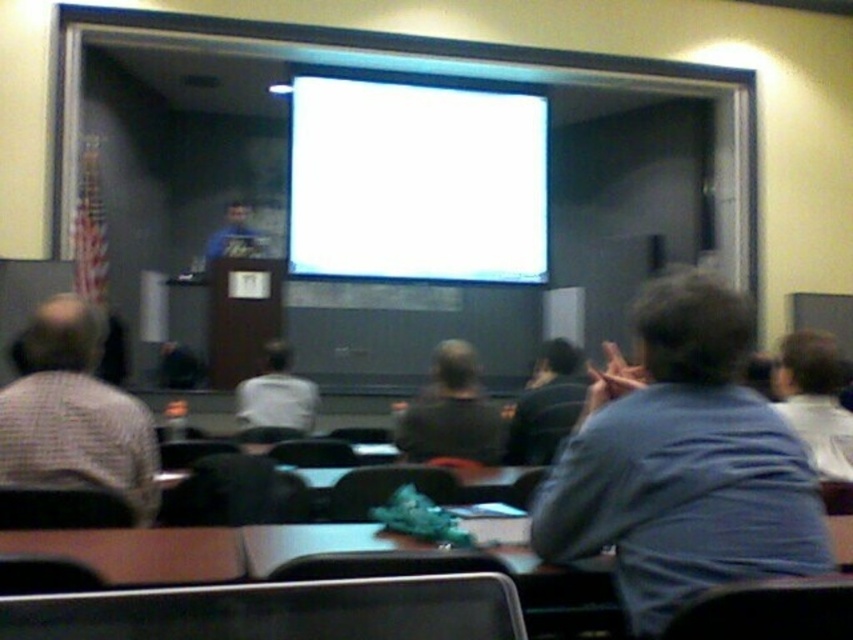
Question: Which object is farther from the camera taking this photo?

Choices:
 (A) dark blue shirt at center
 (B) light blue shirt at center

Answer: (A)

Question: Among these objects, which one is nearest to the camera?

Choices:
 (A) white glossy projection screen at upper center
 (B) blue fabric at center
 (C) dark gray shirt at center
 (D) light blue shirt at center

Answer: (D)

Question: Can you confirm if dark blue shirt at center is smaller than blue fabric at center?

Choices:
 (A) yes
 (B) no

Answer: (A)

Question: Which of the following is the closest to the observer?

Choices:
 (A) blue shirt at right
 (B) dark blue shirt at center
 (C) gray checkered shirt at left

Answer: (A)

Question: Where is blue shirt at right located in relation to dark blue shirt at center in the image?

Choices:
 (A) above
 (B) below

Answer: (A)

Question: Can you confirm if light blue shirt at center is positioned below blue fabric at center?

Choices:
 (A) yes
 (B) no

Answer: (A)